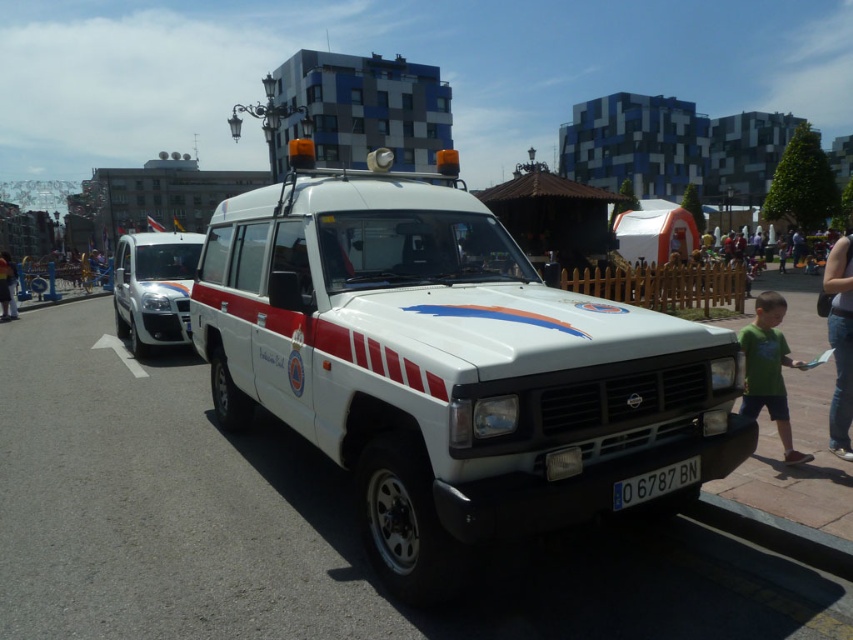
Question: Which point appears closest to the camera in this image?

Choices:
 (A) (189, 337)
 (B) (779, 378)
 (C) (323, 192)

Answer: (C)

Question: Where is green cotton shirt at lower right located in relation to black plastic license plate at center in the image?

Choices:
 (A) above
 (B) below

Answer: (A)

Question: Is white glossy van at left thinner than black plastic license plate at center?

Choices:
 (A) no
 (B) yes

Answer: (A)

Question: Does white matte fire truck at center appear on the left side of black plastic license plate at center?

Choices:
 (A) yes
 (B) no

Answer: (A)

Question: Which object appears closest to the camera in this image?

Choices:
 (A) white matte fire truck at center
 (B) black plastic license plate at center

Answer: (A)

Question: Which object appears farthest from the camera in this image?

Choices:
 (A) white matte fire truck at center
 (B) white glossy van at left

Answer: (B)